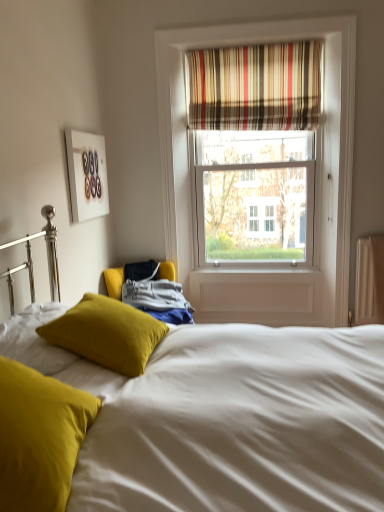
Question: Looking at the image, does matte yellow pillow at lower left, the 2th pillow in the back-to-front sequence, seem bigger or smaller compared to striped fabric curtain at upper center?

Choices:
 (A) big
 (B) small

Answer: (B)

Question: In the image, is matte yellow pillow at lower left, the first pillow when ordered from front to back, positioned in front of or behind striped fabric curtain at upper center?

Choices:
 (A) behind
 (B) front

Answer: (B)

Question: Which object is the farthest from the velvet mustard pillow at center, which is the 2th pillow from front to back?

Choices:
 (A) striped fabric curtain at upper center
 (B) velvet yellow pillow at center
 (C) white matte picture frame at upper left
 (D) matte yellow pillow at lower left, the 2th pillow in the back-to-front sequence

Answer: (A)

Question: Which object is positioned closest to the matte yellow pillow at lower left, the first pillow when ordered from front to back?

Choices:
 (A) striped fabric curtain at upper center
 (B) velvet mustard pillow at center, positioned as the 1th pillow in back-to-front order
 (C) white matte picture frame at upper left
 (D) velvet yellow pillow at center

Answer: (D)